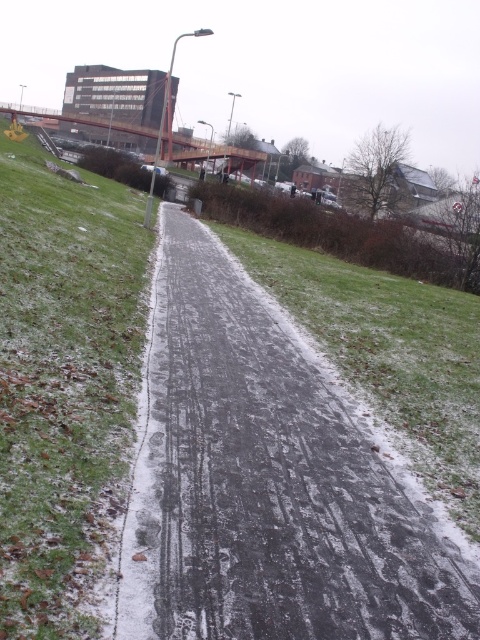
Consider the image. You are a delivery person trying to navigate through the snow. You see the slick asphalt road at center and the green grass at lower left. Which surface is closer to you as you approach the scene?

The slick asphalt road at center is closer to you than the green grass at lower left because it is further to the viewer.

You are a delivery person trying to avoid slipping on the snow. You see the slick asphalt road at center and the green grass at lower left. Which surface is more likely to be slippery?

The slick asphalt road at center is more likely to be slippery because it is described as slick, while the green grass at lower left is not mentioned to have that characteristic.

You are standing at the starting point of the path and want to reach the red pedestrian bridge. According to the coordinates provided, where exactly is the slick asphalt road at center located in relation to your current position?

The slick asphalt road at center is located at coordinates point (268, 481), so it is positioned to the right and slightly forward from your current starting position on the path.